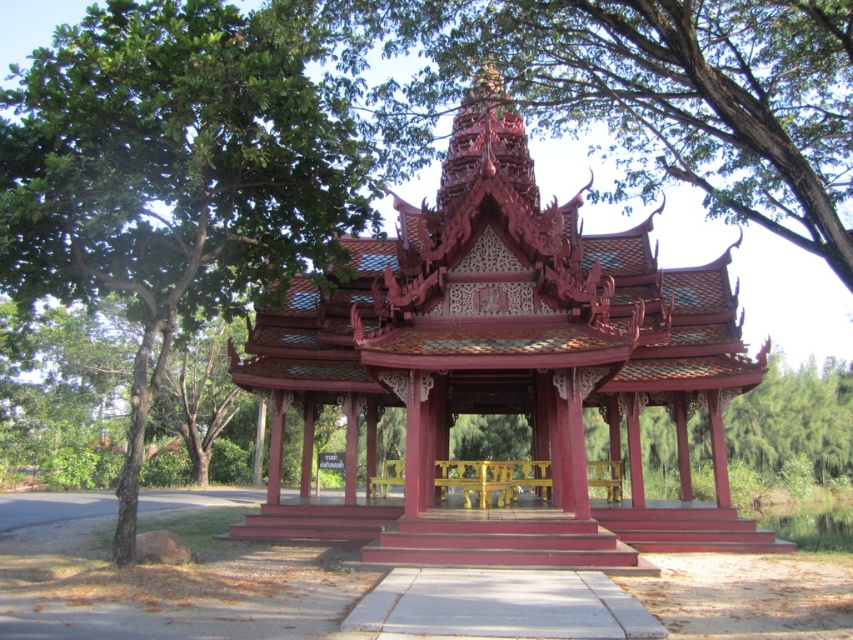
You are planning to set up a picnic table under the glossy wood gazebo at center. Considering the height of the green leafy tree at upper left, will the gazebo provide sufficient shade during midday when the sun is directly overhead?

The glossy wood gazebo at center has a lesser height compared to the green leafy tree at upper left. Since the gazebo is shorter, its shadow might be shorter than the tree, so the shade provided by the gazebo might not be sufficient during midday when the sun is overhead.

You are standing in the park and want to take a photo of both the glossy wood gazebo at center and the green leafy tree at upper left. Which object should you position to your left side to include both in the frame?

To include both the glossy wood gazebo at center and the green leafy tree at upper left in the frame, position the green leafy tree at upper left to your left side since the glossy wood gazebo at center is to the right of it.